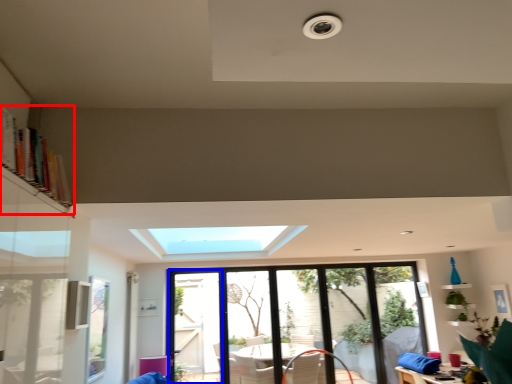
Question: Which of the following is the closest to the observer, bookshelf (highlighted by a red box) or screen door (highlighted by a blue box)?

Choices:
 (A) bookshelf
 (B) screen door

Answer: (A)